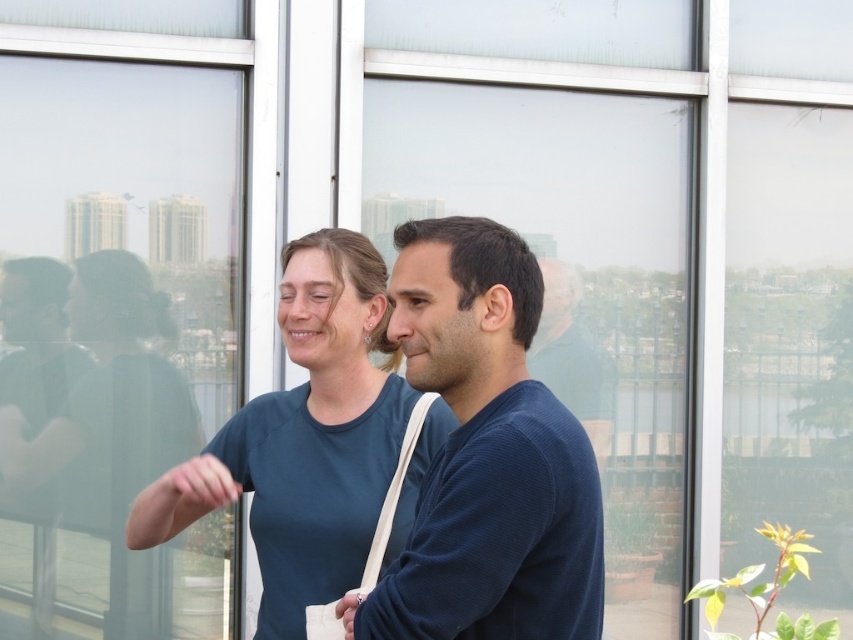
You are a delivery person trying to hand a package to the woman wearing the blue knitted sweater at center. The transparent glass window at center is in your way. Can you step aside to avoid the window and still reach her?

The transparent glass window at center is much taller than the blue knitted sweater at center, so stepping aside might not be necessary as the window is taller but not necessarily blocking the path. However, since the window is at center, moving to the side could allow you to bypass it while still reaching the woman.

You are a delivery person who needs to hand over a package to the person wearing the blue knitted sweater at center. However, there is a transparent glass window at center blocking your path. Can you reach the person through the window or do you need to go around it?

The transparent glass window at center is above the blue knitted sweater at center, so you can reach the person through the window since the window is positioned above and not blocking the path directly.